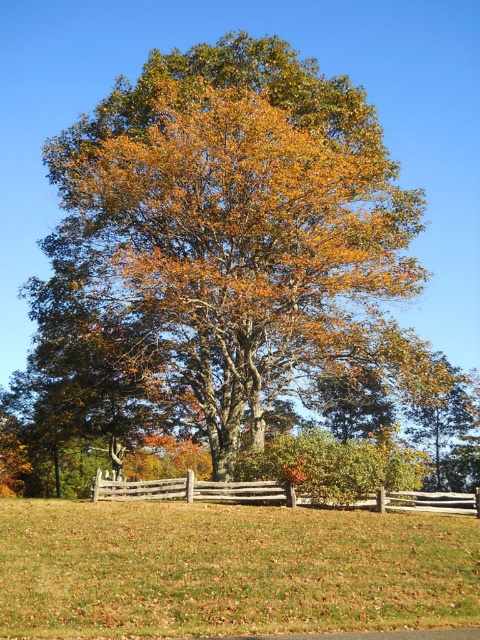
You are standing at the edge of the field and want to walk towards the tree in the center. Since both the green grass at lower center and the brown wooden fence at lower center are in your path, which one will you step on first?

The green grass at lower center is located above the brown wooden fence at lower center, so you will step on the green grass at lower center first before reaching the brown wooden fence at lower center.